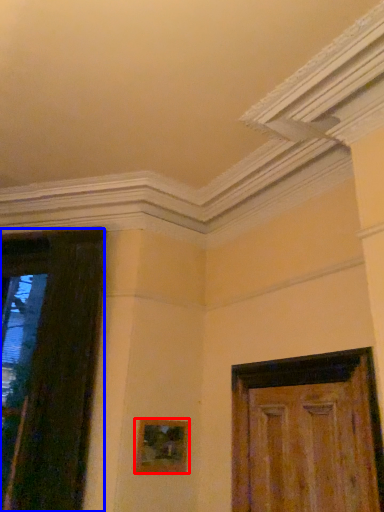
Question: Among these objects, which one is farthest to the camera, picture frame (highlighted by a red box) or door (highlighted by a blue box)?

Choices:
 (A) picture frame
 (B) door

Answer: (A)